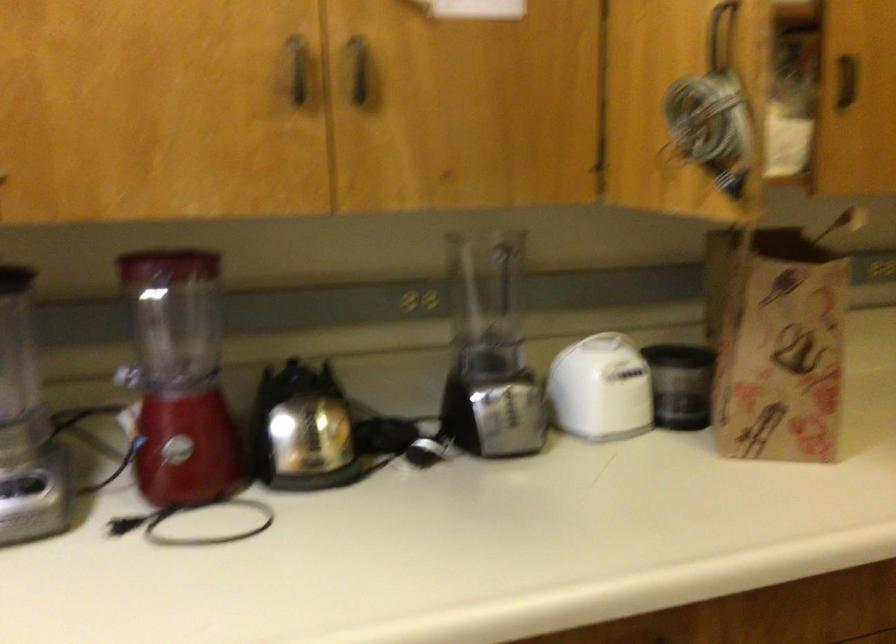
Where is `white kitchen appliance`? The image size is (896, 644). white kitchen appliance is located at coordinates (600, 389).